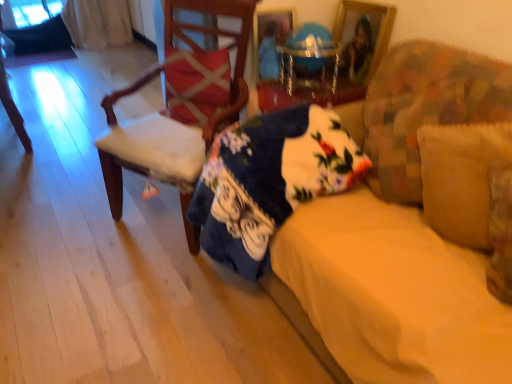
Identify the location of free space that is to the left of wooden chair at left, which appears as the 1th chair when viewed from the front. (69, 207).